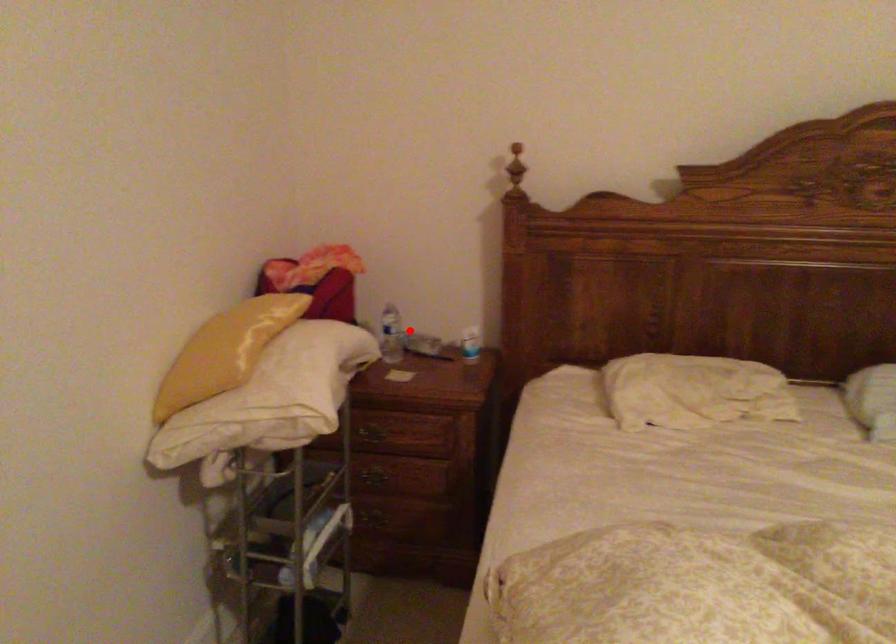
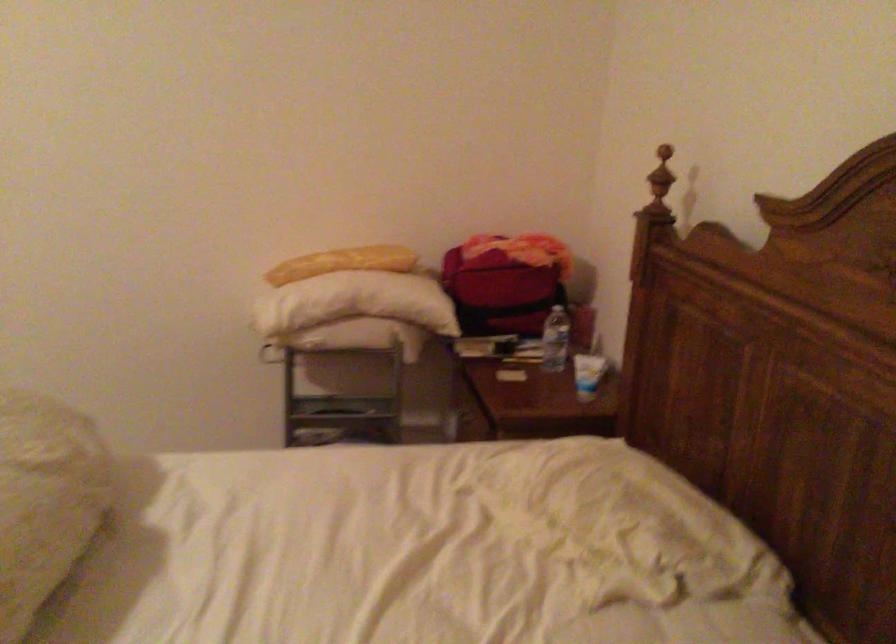
Question: I am providing you with two images of the same scene from different viewpoints. A red point is shown in image1. For the corresponding object point in image2, is it positioned nearer or farther from the camera?

Choices:
 (A) Nearer
 (B) Farther

Answer: (A)